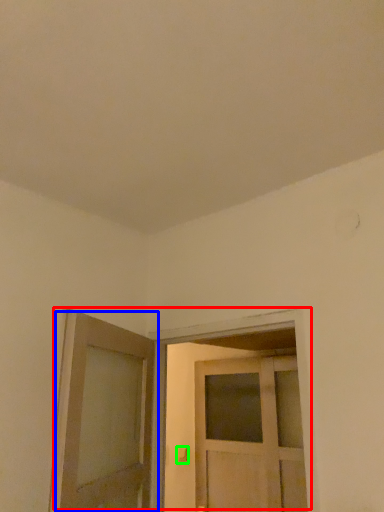
Question: Estimate the real-world distances between objects in this image. Which object is closer to door (highlighted by a red box), door (highlighted by a blue box) or door handle (highlighted by a green box)?

Choices:
 (A) door
 (B) door handle

Answer: (A)